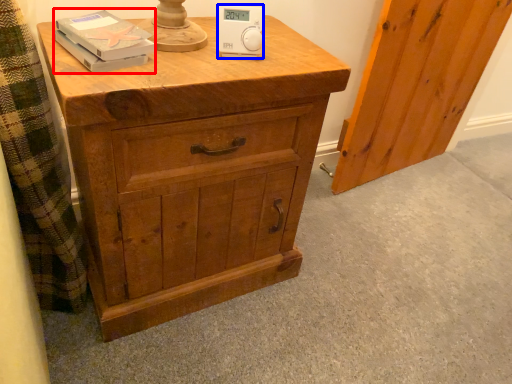
Question: Which point is further to the camera, book (highlighted by a red box) or ipod (highlighted by a blue box)?

Choices:
 (A) book
 (B) ipod

Answer: (B)